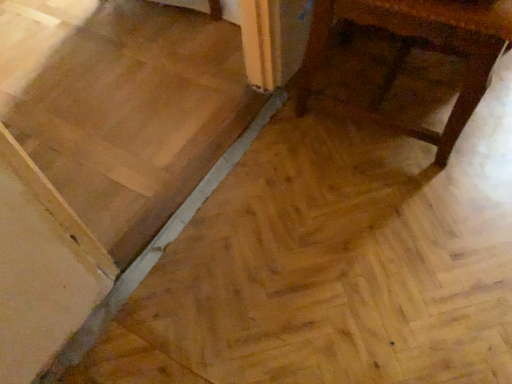
Where is `wooden chair at right`? wooden chair at right is located at coordinates (419, 47).

Describe the element at coordinates (419, 47) in the screenshot. I see `wooden chair at right` at that location.

At what (x,y) coordinates should I click in order to perform the action: click on wooden chair at right. Please return your answer as a coordinate pair (x, y). Looking at the image, I should click on (419, 47).